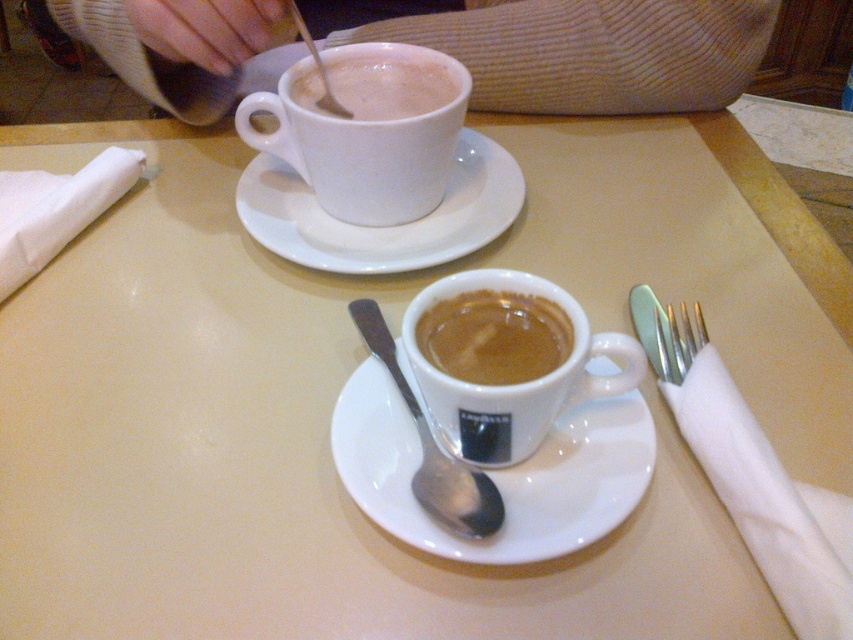
Who is positioned more to the right, matte white cup at upper center or silver metallic fork at right?

From the viewer's perspective, silver metallic fork at right appears more on the right side.

Is matte white cup at upper center above silver metallic fork at right?

Correct, matte white cup at upper center is located above silver metallic fork at right.

The width and height of the screenshot is (853, 640). Identify the location of matte white cup at upper center. (376, 88).

Who is shorter, white glossy cup at center or silver metallic spoon at center?

white glossy cup at center

The image size is (853, 640). In order to click on white glossy cup at center in this screenshot , I will do `click(514, 385)`.

At what (x,y) coordinates should I click in order to perform the action: click on white glossy cup at center. Please return your answer as a coordinate pair (x, y). This screenshot has height=640, width=853. Looking at the image, I should click on (514, 385).

In the scene shown: Can you confirm if white ceramic saucer at upper center is bigger than brown matte espresso cup at center?

Yes.

Can you confirm if white ceramic saucer at upper center is positioned to the right of brown matte espresso cup at center?

No, white ceramic saucer at upper center is not to the right of brown matte espresso cup at center.

What do you see at coordinates (383, 227) in the screenshot? I see `white ceramic saucer at upper center` at bounding box center [383, 227].

Where is `white ceramic saucer at upper center`? The image size is (853, 640). white ceramic saucer at upper center is located at coordinates (383, 227).